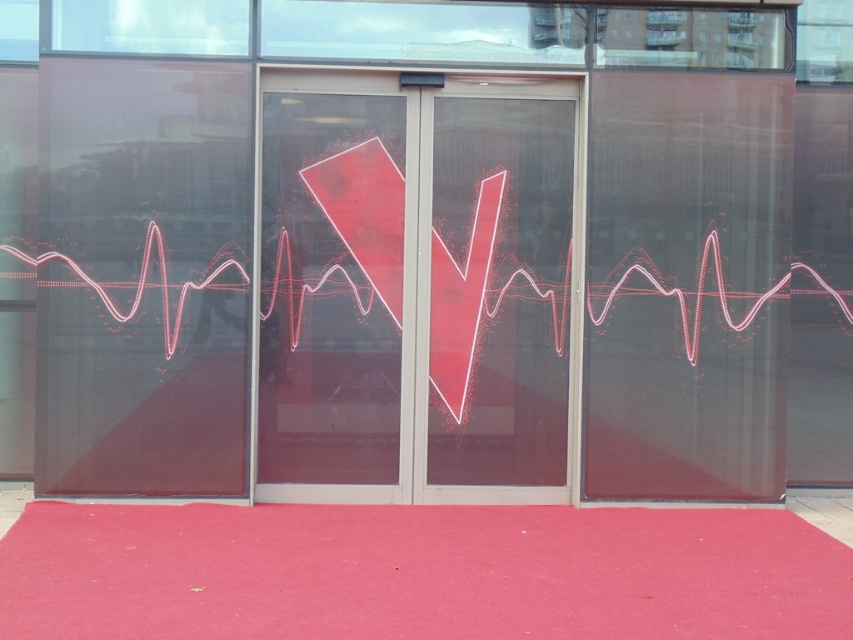
Question: Among these objects, which one is farthest from the camera?

Choices:
 (A) transparent glass door at center
 (B) matte red carpet at center

Answer: (A)

Question: Is transparent glass door at center positioned at the back of matte red carpet at center?

Choices:
 (A) no
 (B) yes

Answer: (B)

Question: Is transparent glass door at center above matte red carpet at center?

Choices:
 (A) no
 (B) yes

Answer: (B)

Question: Does transparent glass door at center come behind matte red carpet at center?

Choices:
 (A) yes
 (B) no

Answer: (A)

Question: Which object is closer to the camera taking this photo?

Choices:
 (A) transparent glass door at center
 (B) matte red carpet at center

Answer: (B)